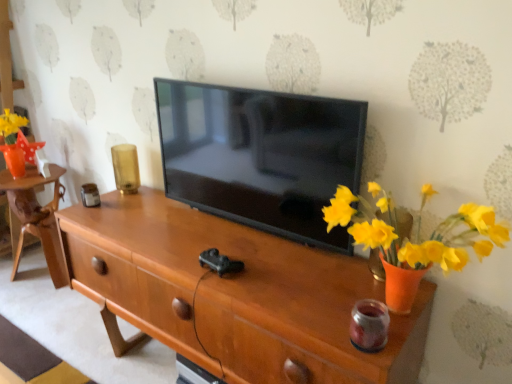
Question: In the image, is wooden cabinet at left positioned in front of or behind wooden tv stand at center?

Choices:
 (A) front
 (B) behind

Answer: (B)

Question: Visually, is wooden cabinet at left positioned to the left or to the right of wooden tv stand at center?

Choices:
 (A) right
 (B) left

Answer: (B)

Question: Estimate the real-world distances between objects in this image. Which object is closer to the wooden tv stand at center?

Choices:
 (A) wooden cabinet at left
 (B) wooden table at left
 (C) black glossy tv at center

Answer: (C)

Question: Which object is the farthest from the wooden cabinet at left?

Choices:
 (A) black glossy tv at center
 (B) wooden table at left
 (C) wooden tv stand at center

Answer: (C)